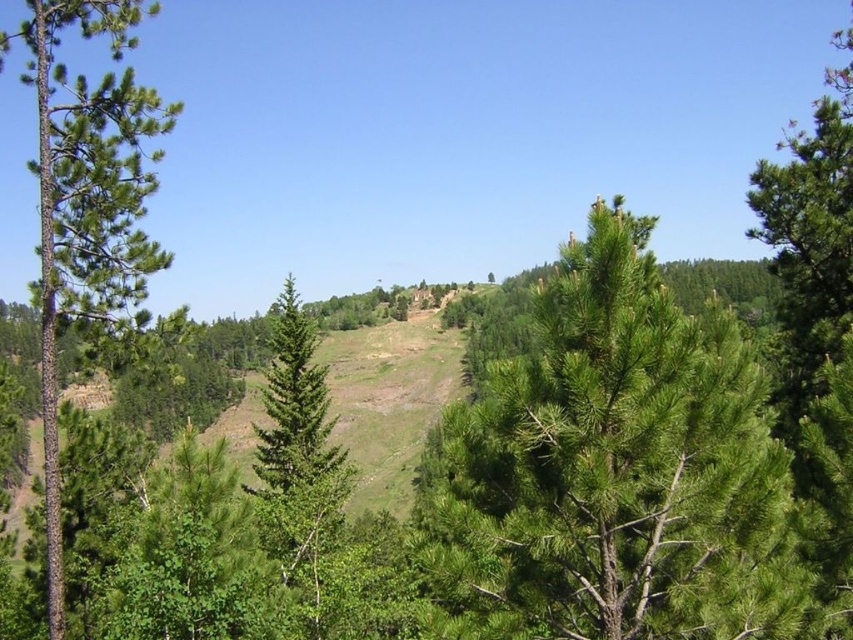
Question: Which object is farther from the camera taking this photo?

Choices:
 (A) green needle-like tree at center
 (B) green rough bark tree at left

Answer: (B)

Question: Can you confirm if green needle-like tree at center is smaller than green rough bark tree at left?

Choices:
 (A) no
 (B) yes

Answer: (B)

Question: Considering the relative positions of green needle-like tree at center and green rough bark tree at left in the image provided, where is green needle-like tree at center located with respect to green rough bark tree at left?

Choices:
 (A) right
 (B) left

Answer: (A)

Question: Can you confirm if green needle-like tree at center is positioned to the left of green rough bark tree at left?

Choices:
 (A) yes
 (B) no

Answer: (B)